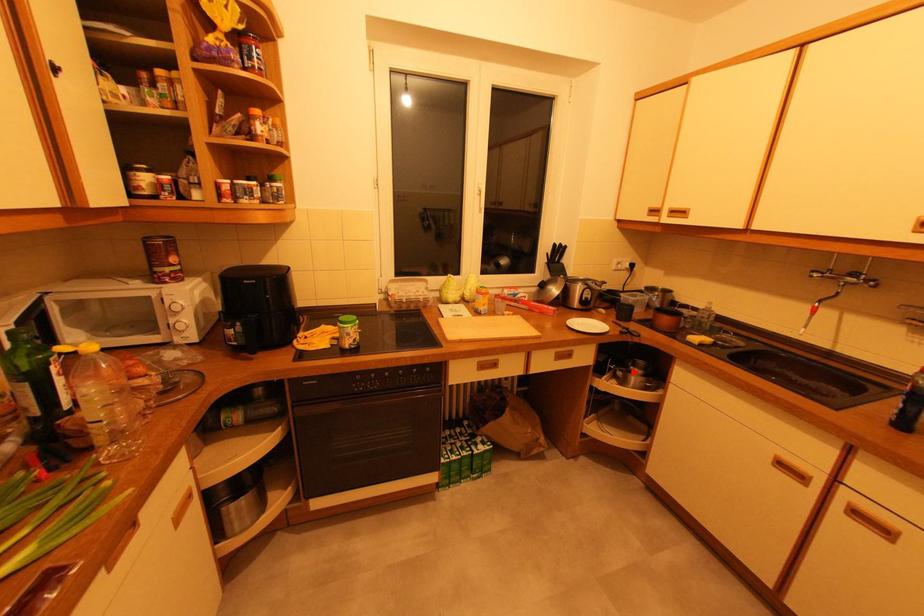
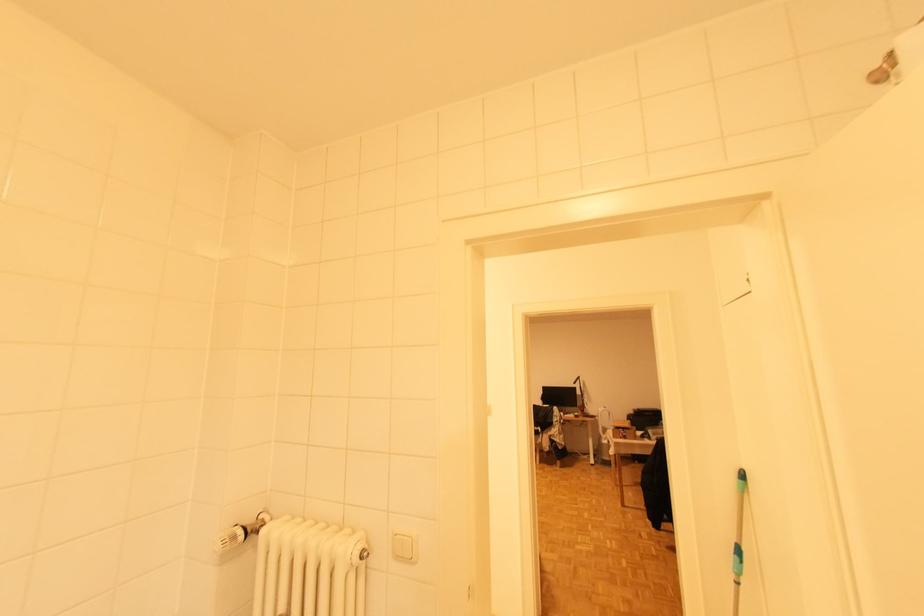
Question: I am providing you with two images of the same scene from different viewpoints. A red point is marked on the first image. At the location where the point appears in image 1, is it still visible in image 2?

Choices:
 (A) Yes
 (B) No

Answer: (B)